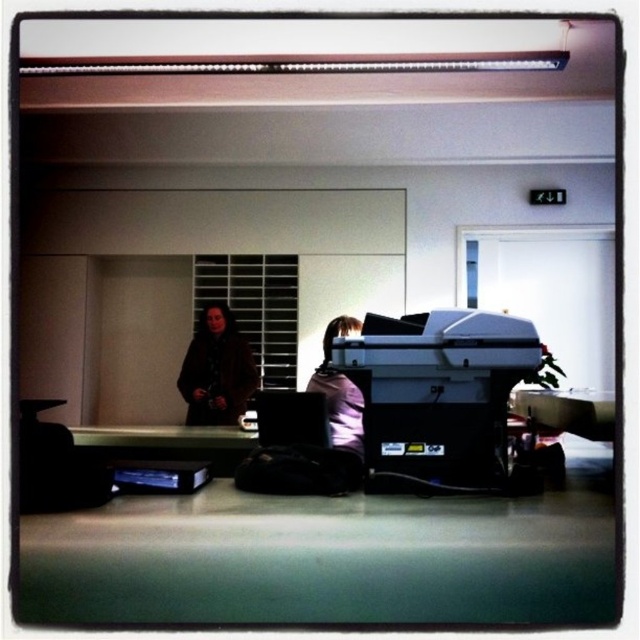
Question: Can you confirm if matte black printer at center is positioned to the left of black plastic printer at center?

Choices:
 (A) no
 (B) yes

Answer: (A)

Question: Is matte black printer at center to the left of brown leather jacket at center from the viewer's perspective?

Choices:
 (A) yes
 (B) no

Answer: (B)

Question: Is matte black printer at center to the left of black plastic printer at center from the viewer's perspective?

Choices:
 (A) no
 (B) yes

Answer: (A)

Question: Estimate the real-world distances between objects in this image. Which object is closer to the brown leather jacket at center?

Choices:
 (A) matte black printer at center
 (B) black plastic printer at center

Answer: (B)

Question: Which is nearer to the black plastic printer at center?

Choices:
 (A) brown leather jacket at center
 (B) matte black printer at center

Answer: (B)

Question: Which object is the farthest from the matte black printer at center?

Choices:
 (A) black plastic printer at center
 (B) brown leather jacket at center

Answer: (B)